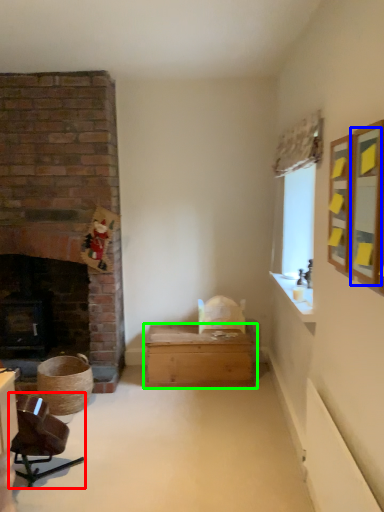
Question: Estimate the real-world distances between objects in this image. Which object is farther from chair (highlighted by a red box), mirror (highlighted by a blue box) or table (highlighted by a green box)?

Choices:
 (A) mirror
 (B) table

Answer: (A)